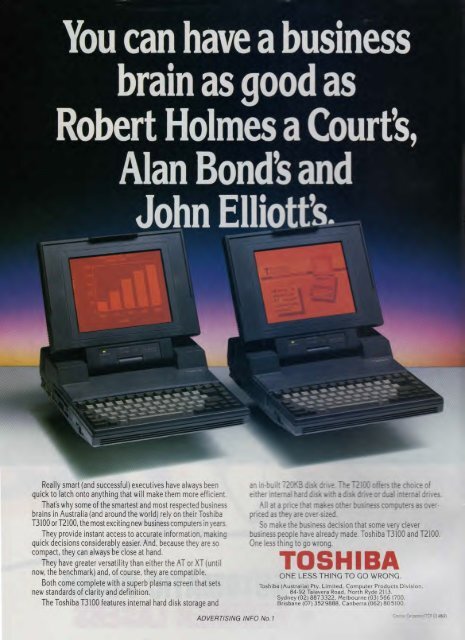
You are a GUI agent. You are given a task and a screenshot of the screen. Output one action in this format:
    pyautogui.click(x=<x>, y=<y>)
    Task: Click on the orange dot matrix displays on each computer
    
    Given the screenshot: What is the action you would take?
    pyautogui.click(x=299, y=276), pyautogui.click(x=150, y=294)